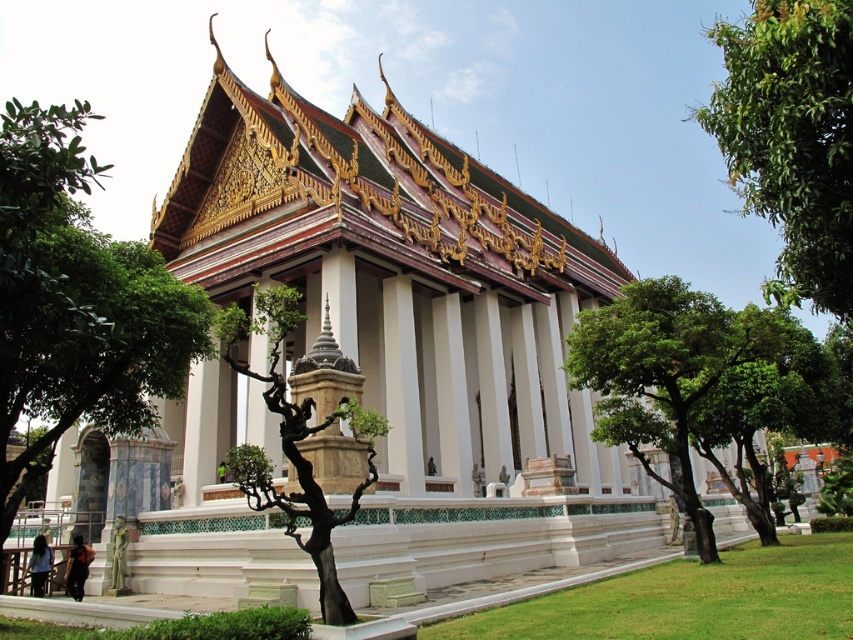
You are planning to install a pathway between the green leafy tree at upper right and the green leafy tree at center in the Thai temple area. What is the minimum length of the pathway required to connect them?

The minimum length of the pathway required to connect the green leafy tree at upper right and the green leafy tree at center is 19.27 meters, as that is the distance between them.

You are a visitor at the Thai temple and want to take a photo that includes both the green leafy tree at upper right and the green leafy tree at center. Which tree should you frame wider in your photo to accurately represent their sizes?

The green leafy tree at upper right should be framed wider because its width is larger than the green leafy tree at center.